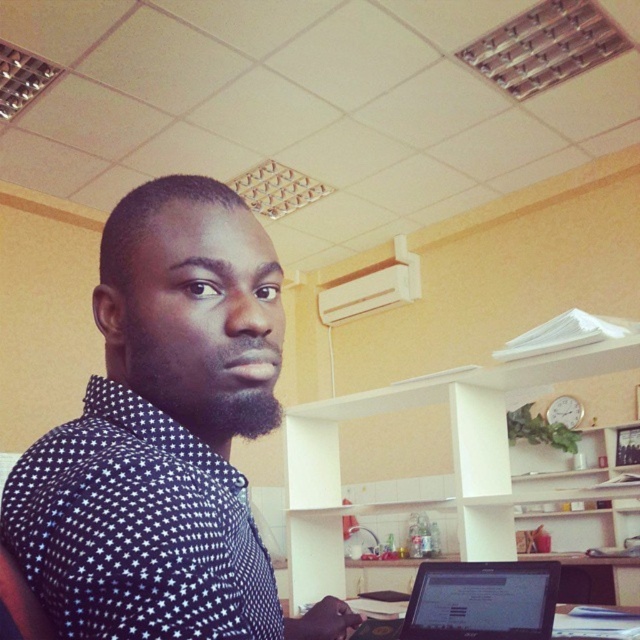
Between black dotted shirt at center and black matte laptop at lower center, which one has more height?

black dotted shirt at center

Image resolution: width=640 pixels, height=640 pixels. In order to click on black dotted shirt at center in this screenshot , I will do `click(164, 435)`.

Does black dotted shirt at center have a greater width compared to black dotted shirt at upper left?

No.

Where is `black dotted shirt at center`? Image resolution: width=640 pixels, height=640 pixels. black dotted shirt at center is located at coordinates (164, 435).

Locate an element on the screen. This screenshot has width=640, height=640. black dotted shirt at center is located at coordinates (164, 435).

Between black dotted shirt at upper left and black matte laptop at lower center, which one appears on the left side from the viewer's perspective?

black dotted shirt at upper left is more to the left.

Find the location of a particular element. black dotted shirt at upper left is located at coordinates (136, 529).